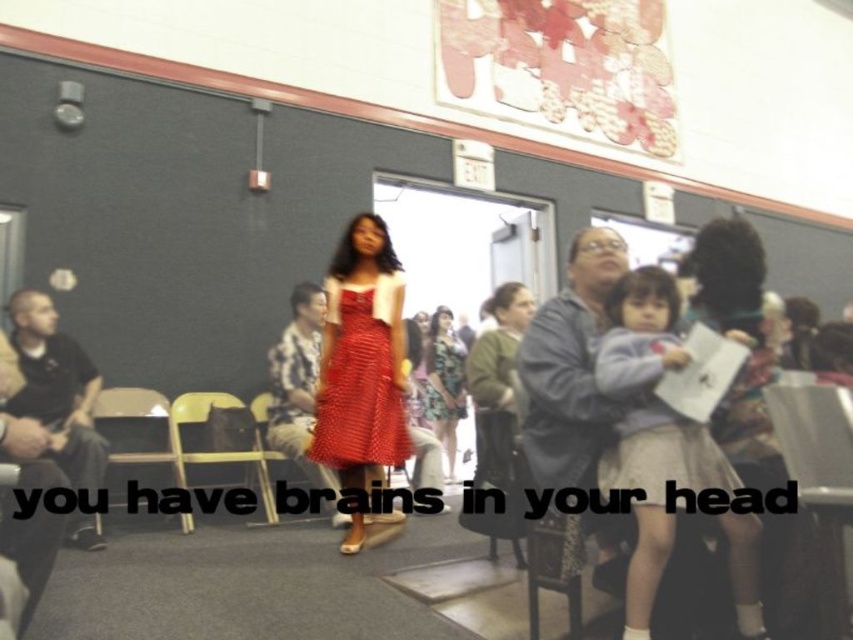
You are organizing a small event in this room and need to place a large tablecloth that covers the entire area where the metallic silver chair at lower right and the matte red dress at center are located. Based on their sizes, which object requires more space to cover?

The matte red dress at center requires more space to cover because it occupies more area than the metallic silver chair at lower right.

Consider the image. You are planning to place a small potted plant on the yellow plastic chair at center. Considering the height of the chair and the dress, will the plant be visible to someone standing behind the matte red dress at center?

The yellow plastic chair at center is taller than the matte red dress at center. Since the chair is taller, the potted plant placed on it will likely be visible to someone standing behind the dress.